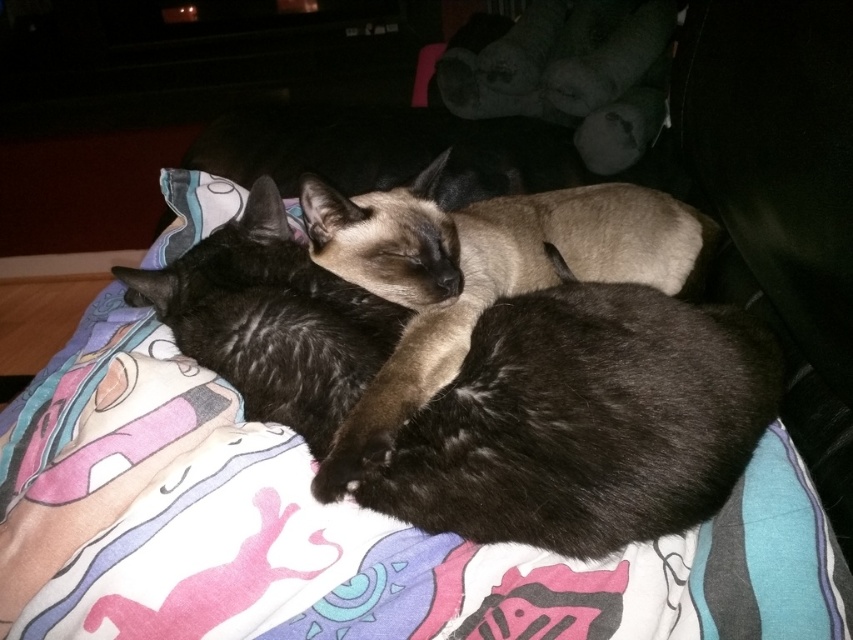
From the picture: You are a photographer setting up a shot of the cats on the printed fabric blanket at center. You want to ensure the blanket is in focus while the cats are slightly blurred. If your camera has a depth of field setting that can blur objects beyond 70 centimeters from the lens, will the blanket remain in focus?

The printed fabric blanket at center is 75.15 centimeters away from the camera. Since the depth of field setting blurs objects beyond 70 centimeters, the blanket is slightly beyond this threshold. Therefore, the blanket may not remain fully in focus and could be slightly blurred.

You are trying to place a small toy on the printed fabric blanket at center. Given that the blanket is positioned at coordinates point 0.830, 0.397, can you confirm if the coordinates are correct for placing the toy?

The printed fabric blanket at center is located at point (338, 531), so yes, placing the toy at those coordinates would be accurate.